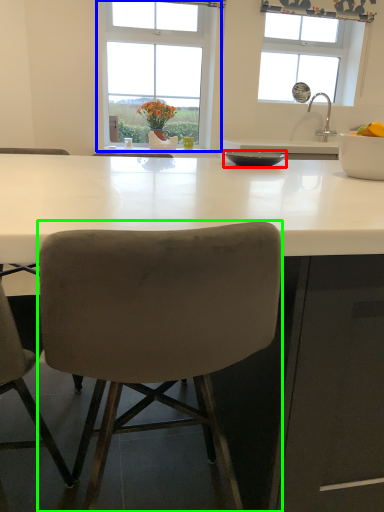
Question: Estimate the real-world distances between objects in this image. Which object is closer to bowl (highlighted by a red box), window (highlighted by a blue box) or chair (highlighted by a green box)?

Choices:
 (A) window
 (B) chair

Answer: (B)